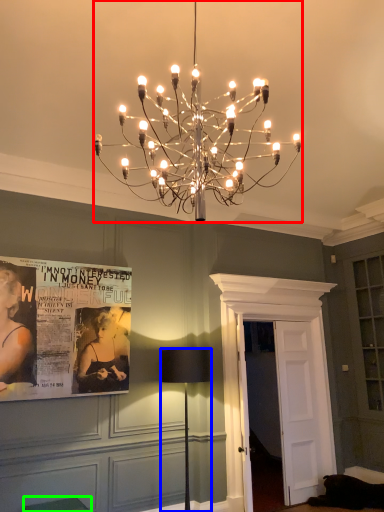
Question: Based on their relative distances, which object is nearer to lamp (highlighted by a red box)? Choose from lamp (highlighted by a blue box) and furniture (highlighted by a green box).

Choices:
 (A) lamp
 (B) furniture

Answer: (A)